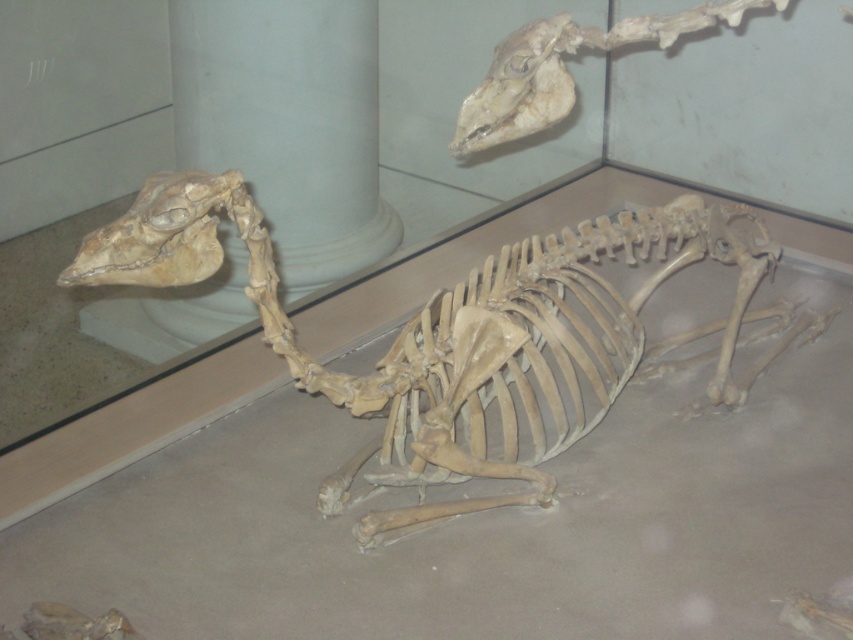
How distant is bone-like skeleton at center from brown bone skull at upper left?

bone-like skeleton at center and brown bone skull at upper left are 16.11 inches apart.

Image resolution: width=853 pixels, height=640 pixels. What do you see at coordinates (456, 330) in the screenshot?
I see `bone-like skeleton at center` at bounding box center [456, 330].

Is point (646, 259) closer to viewer compared to point (135, 209)?

No, it is not.

Where is `bone-like skeleton at center`? This screenshot has height=640, width=853. bone-like skeleton at center is located at coordinates (456, 330).

Does white marble pillar at upper center have a smaller size compared to brown bone skull at upper left?

Incorrect, white marble pillar at upper center is not smaller in size than brown bone skull at upper left.

Who is more forward, (x=312, y=266) or (x=204, y=244)?

Point (x=204, y=244) is in front.

At what (x,y) coordinates should I click in order to perform the action: click on white marble pillar at upper center. Please return your answer as a coordinate pair (x, y). The width and height of the screenshot is (853, 640). Looking at the image, I should click on (288, 124).

Does white marble pillar at upper center have a lesser width compared to light brown bone at upper center?

In fact, white marble pillar at upper center might be wider than light brown bone at upper center.

Identify the location of white marble pillar at upper center. The image size is (853, 640). (288, 124).

You are a GUI agent. You are given a task and a screenshot of the screen. Output one action in this format:
    pyautogui.click(x=<x>, y=<y>)
    Task: Click on the white marble pillar at upper center
    The height and width of the screenshot is (640, 853).
    Given the screenshot: What is the action you would take?
    pyautogui.click(x=288, y=124)

Locate an element on the screen. This screenshot has height=640, width=853. white marble pillar at upper center is located at coordinates (288, 124).